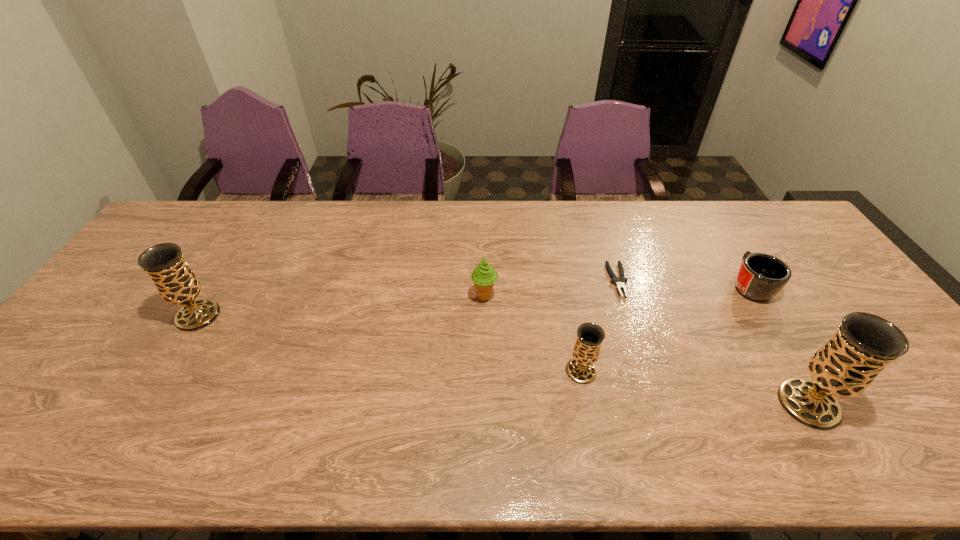
The height and width of the screenshot is (540, 960). I want to click on spot to insert another chalice for uniform distribution, so click(x=379, y=342).